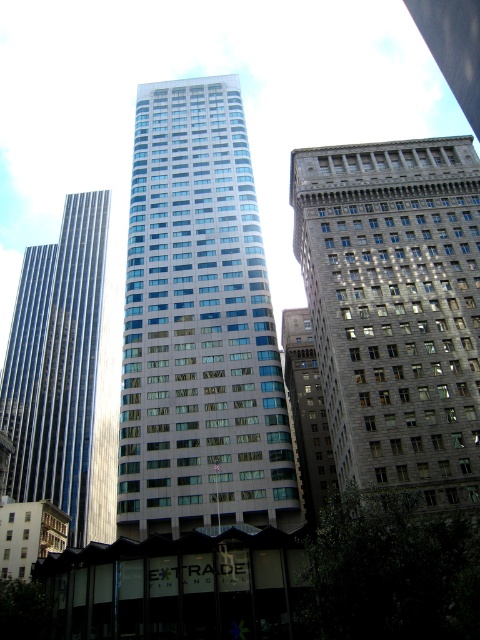
Question: Which point is farther from the camera taking this photo?

Choices:
 (A) (396, 301)
 (B) (41, 358)
 (C) (297, 321)

Answer: (B)

Question: Is gray stone building at center bigger than dark gray stone building at center?

Choices:
 (A) yes
 (B) no

Answer: (A)

Question: Is shiny metallic skyscraper at left wider than dark gray stone building at center?

Choices:
 (A) yes
 (B) no

Answer: (A)

Question: Which object is positioned farthest from the glassy reflective skyscraper at center?

Choices:
 (A) dark gray stone building at center
 (B) shiny metallic skyscraper at left

Answer: (B)

Question: Does gray stone building at center have a smaller size compared to dark gray stone building at center?

Choices:
 (A) yes
 (B) no

Answer: (B)

Question: Which point appears farthest from the camera in this image?

Choices:
 (A) (317, 365)
 (B) (314, 512)
 (C) (75, 212)

Answer: (C)